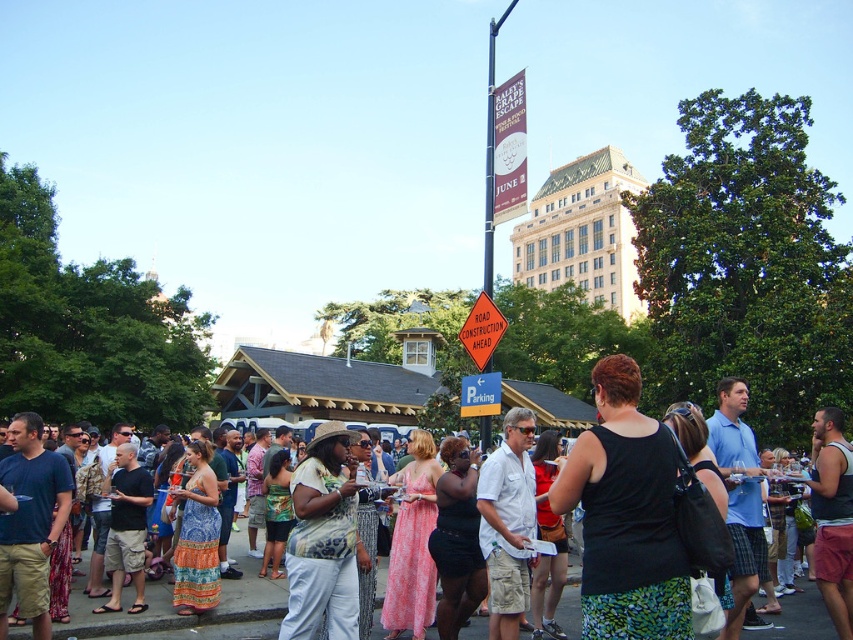
Is point (262, 589) more distant than point (490, 404)?

No, it is in front of (490, 404).

Can you confirm if matte black dress at center is taller than yellow plastic parking sign at center?

Incorrect, matte black dress at center's height is not larger of yellow plastic parking sign at center's.

What are the coordinates of `matte black dress at center` in the screenshot? It's located at (186, 618).

You are a GUI agent. You are given a task and a screenshot of the screen. Output one action in this format:
    pyautogui.click(x=<x>, y=<y>)
    Task: Click on the matte black dress at center
    The height and width of the screenshot is (640, 853).
    Given the screenshot: What is the action you would take?
    pyautogui.click(x=186, y=618)

Measure the distance between point (465, 348) and camera.

Point (465, 348) is 36.95 meters away from camera.

This screenshot has height=640, width=853. What do you see at coordinates (482, 330) in the screenshot? I see `orange diamond-shaped road construction sign at center` at bounding box center [482, 330].

Locate an element on the screen. This screenshot has width=853, height=640. orange diamond-shaped road construction sign at center is located at coordinates (482, 330).

Does point (172, 632) come in front of point (495, 342)?

Yes.

Does matte black dress at center have a greater width compared to orange diamond-shaped road construction sign at center?

Yes.

Is point (576, 609) behind point (465, 333)?

That is False.

Where is `matte black dress at center`? matte black dress at center is located at coordinates (186, 618).